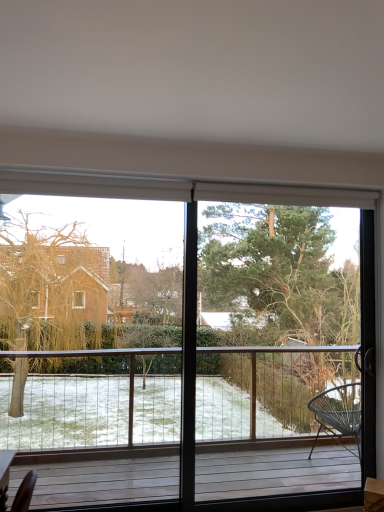
Question: Does green textured tree at center have a smaller size compared to transparent glass window at center?

Choices:
 (A) yes
 (B) no

Answer: (B)

Question: Is transparent glass window at center at the back of green textured tree at center?

Choices:
 (A) yes
 (B) no

Answer: (A)

Question: From the image's perspective, is green textured tree at center below transparent glass window at center?

Choices:
 (A) no
 (B) yes

Answer: (A)

Question: Is green textured tree at center next to transparent glass window at center?

Choices:
 (A) no
 (B) yes

Answer: (A)

Question: Is green textured tree at center oriented towards transparent glass window at center?

Choices:
 (A) no
 (B) yes

Answer: (B)

Question: From a real-world perspective, is green textured tree at center below transparent glass window at center?

Choices:
 (A) yes
 (B) no

Answer: (B)

Question: Is transparent glass window at center outside green textured tree at center?

Choices:
 (A) no
 (B) yes

Answer: (A)

Question: Is transparent glass window at center next to green textured tree at center and touching it?

Choices:
 (A) yes
 (B) no

Answer: (B)

Question: Is transparent glass window at center further to the viewer compared to green textured tree at center?

Choices:
 (A) no
 (B) yes

Answer: (A)

Question: Does transparent glass window at center have a lesser height compared to green textured tree at center?

Choices:
 (A) no
 (B) yes

Answer: (B)

Question: Could you tell me if transparent glass window at center is facing green textured tree at center?

Choices:
 (A) no
 (B) yes

Answer: (B)

Question: Does transparent glass window at center have a greater width compared to green textured tree at center?

Choices:
 (A) no
 (B) yes

Answer: (A)

Question: Considering the positions of green textured tree at center and transparent glass window at center in the image, is green textured tree at center bigger or smaller than transparent glass window at center?

Choices:
 (A) small
 (B) big

Answer: (B)